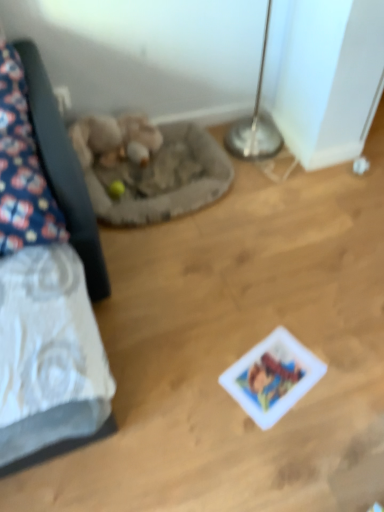
Where is `free area in between fuzzy beige stuffed animal at center-left and white glossy card at center`? free area in between fuzzy beige stuffed animal at center-left and white glossy card at center is located at coordinates (205, 274).